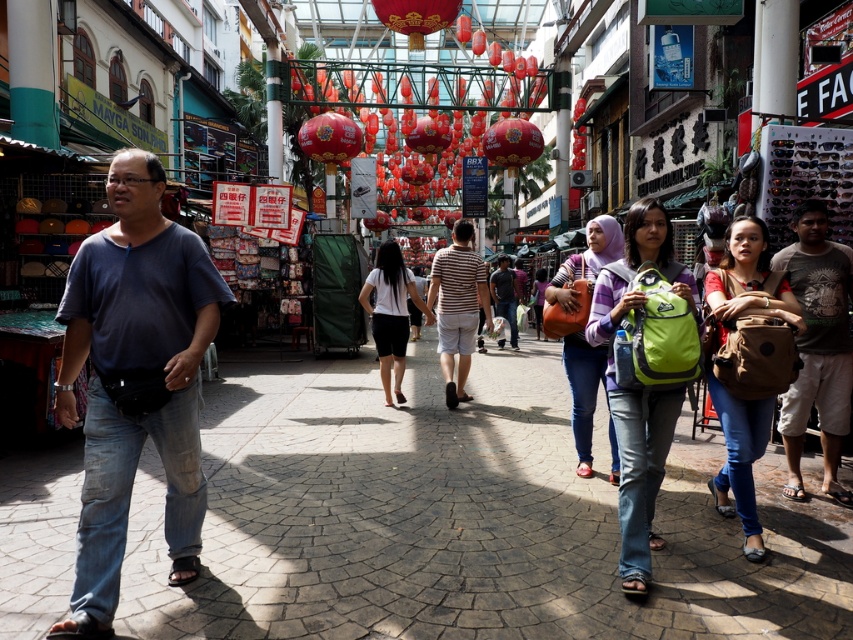
Is paved stone at center below striped cotton shirt at center?

Yes.

Between point (444, 504) and point (450, 300), which one is positioned in front?

Point (444, 504) is more forward.

At what (x,y) coordinates should I click in order to perform the action: click on paved stone at center. Please return your answer as a coordinate pair (x, y). The height and width of the screenshot is (640, 853). Looking at the image, I should click on (457, 518).

Consider the image. Is paved stone at center smaller than brown fabric backpack at right?

Yes.

Does point (833, 589) lie behind point (785, 444)?

No, (833, 589) is closer to viewer.

Who is more forward, (323, 600) or (833, 356)?

Point (323, 600)

Identify the location of paved stone at center. (457, 518).

Does striped cotton shirt at center appear on the left side of dark blue shirt at center?

Indeed, striped cotton shirt at center is positioned on the left side of dark blue shirt at center.

Image resolution: width=853 pixels, height=640 pixels. Describe the element at coordinates (457, 307) in the screenshot. I see `striped cotton shirt at center` at that location.

Is point (450, 396) less distant than point (514, 285)?

That is True.

Identify the location of striped cotton shirt at center. (x=457, y=307).